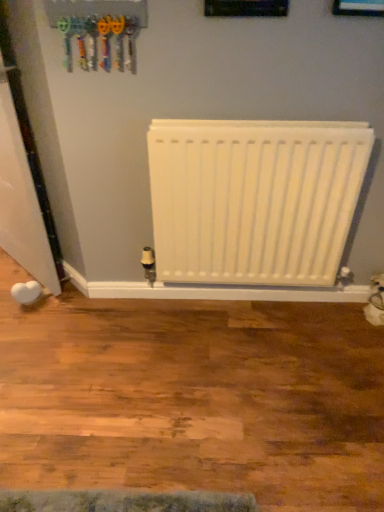
Identify the location of plastic toy keys at upper left. The width and height of the screenshot is (384, 512). (101, 41).

The height and width of the screenshot is (512, 384). What do you see at coordinates (21, 199) in the screenshot? I see `white glossy door at left` at bounding box center [21, 199].

The image size is (384, 512). What are the coordinates of `blue glossy picture frame at upper center` in the screenshot? It's located at (358, 8).

This screenshot has width=384, height=512. I want to click on plastic toy keys at upper left, so click(101, 41).

Which is in front, point (32, 198) or point (60, 25)?

The point (60, 25) is more forward.

From a real-world perspective, is white glossy door at left beneath plastic toy keys at upper left?

Yes, from a real-world perspective, white glossy door at left is below plastic toy keys at upper left.

Consider the image. Is white glossy door at left aimed at plastic toy keys at upper left?

No, white glossy door at left is not aimed at plastic toy keys at upper left.

From the image's perspective, does white glossy door at left appear higher than plastic toy keys at upper left?

No, from the image's perspective, white glossy door at left is not over plastic toy keys at upper left.

Find the location of a particular element. This screenshot has height=512, width=384. tool that appears below the blue glossy picture frame at upper center (from the image's perspective) is located at coordinates (101, 41).

From a real-world perspective, is blue glossy picture frame at upper center on top of plastic toy keys at upper left?

Indeed, from a real-world perspective, blue glossy picture frame at upper center stands above plastic toy keys at upper left.

Which is in front, point (363, 14) or point (127, 23)?

The point (363, 14) is in front.

Which object is further away from the camera taking this photo, plastic toy keys at upper left or blue glossy picture frame at upper center?

plastic toy keys at upper left is further away from the camera.

Would you say plastic toy keys at upper left contains blue glossy picture frame at upper center?

No.

Does point (107, 57) appear closer or farther from the camera than point (352, 4)?

Point (107, 57) appears to be farther away from the viewer than point (352, 4).

Is the position of white matte radiator at center less distant than that of blue glossy picture frame at upper center?

No, it is behind blue glossy picture frame at upper center.

At what (x,y) coordinates should I click in order to perform the action: click on radiator that is under the blue glossy picture frame at upper center (from a real-world perspective). Please return your answer as a coordinate pair (x, y). The height and width of the screenshot is (512, 384). Looking at the image, I should click on (254, 199).

Is white matte radiator at center shorter than blue glossy picture frame at upper center?

Incorrect, the height of white matte radiator at center does not fall short of that of blue glossy picture frame at upper center.

Considering the points (330, 283) and (350, 15), which point is in front, point (330, 283) or point (350, 15)?

The point (350, 15) is more forward.

Is white glossy door at left shorter than blue glossy picture frame at upper center?

Incorrect, the height of white glossy door at left does not fall short of that of blue glossy picture frame at upper center.

Can you confirm if white glossy door at left is positioned to the left of blue glossy picture frame at upper center?

Indeed, white glossy door at left is positioned on the left side of blue glossy picture frame at upper center.

Would you say white glossy door at left contains blue glossy picture frame at upper center?

No, blue glossy picture frame at upper center is not surrounded by white glossy door at left.

This screenshot has width=384, height=512. Find the location of `tool in front of the white matte radiator at center`. tool in front of the white matte radiator at center is located at coordinates point(101,41).

Visually, is white matte radiator at center positioned to the left or to the right of plastic toy keys at upper left?

white matte radiator at center is positioned on plastic toy keys at upper left's right side.

Between white matte radiator at center and plastic toy keys at upper left, which one has larger size?

white matte radiator at center.

Is the surface of white matte radiator at center in direct contact with white glossy door at left?

No, white matte radiator at center is not beside white glossy door at left.

Considering the sizes of objects white matte radiator at center and white glossy door at left in the image provided, who is bigger, white matte radiator at center or white glossy door at left?

Bigger between the two is white glossy door at left.

Between white matte radiator at center and white glossy door at left, which one has smaller width?

white matte radiator at center is thinner.

I want to click on tool positioned vertically above the white glossy door at left (from a real-world perspective), so pos(101,41).

In the image, there is a blue glossy picture frame at upper center. In order to click on tool below it (from the image's perspective) in this screenshot , I will do `click(101, 41)`.

From the image, which object appears to be nearer to white glossy door at left, plastic toy keys at upper left or white matte radiator at center?

plastic toy keys at upper left is positioned closer to the anchor white glossy door at left.

Looking at the image, which one is located further to plastic toy keys at upper left, white matte radiator at center or white glossy door at left?

The object further to plastic toy keys at upper left is white matte radiator at center.

When comparing their distances from plastic toy keys at upper left, does white glossy door at left or white matte radiator at center seem closer?

The object closer to plastic toy keys at upper left is white glossy door at left.

Estimate the real-world distances between objects in this image. Which object is further from white matte radiator at center, blue glossy picture frame at upper center or plastic toy keys at upper left?

Among the two, blue glossy picture frame at upper center is located further to white matte radiator at center.

Looking at the image, which one is located closer to white matte radiator at center, white glossy door at left or blue glossy picture frame at upper center?

Based on the image, blue glossy picture frame at upper center appears to be nearer to white matte radiator at center.

Which object lies nearer to the anchor point blue glossy picture frame at upper center, plastic toy keys at upper left or white matte radiator at center?

Based on the image, white matte radiator at center appears to be nearer to blue glossy picture frame at upper center.

When comparing their distances from plastic toy keys at upper left, does white matte radiator at center or blue glossy picture frame at upper center seem closer?

white matte radiator at center.

Looking at the image, which one is located further to plastic toy keys at upper left, blue glossy picture frame at upper center or white matte radiator at center?

Based on the image, blue glossy picture frame at upper center appears to be further to plastic toy keys at upper left.

Where is `tool between white glossy door at left and white matte radiator at center`? The image size is (384, 512). tool between white glossy door at left and white matte radiator at center is located at coordinates (101, 41).

Locate an element on the screen. tool situated between white glossy door at left and blue glossy picture frame at upper center from left to right is located at coordinates (101, 41).

This screenshot has height=512, width=384. I want to click on radiator located between plastic toy keys at upper left and blue glossy picture frame at upper center in the left-right direction, so click(254, 199).

Locate an element on the screen. radiator located between white glossy door at left and blue glossy picture frame at upper center in the left-right direction is located at coordinates (254, 199).